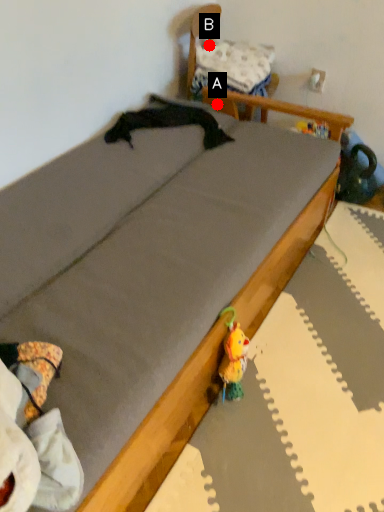
Question: Two points are circled on the image, labeled by A and B beside each circle. Which point appears farthest from the camera in this image?

Choices:
 (A) A is further
 (B) B is further

Answer: (B)